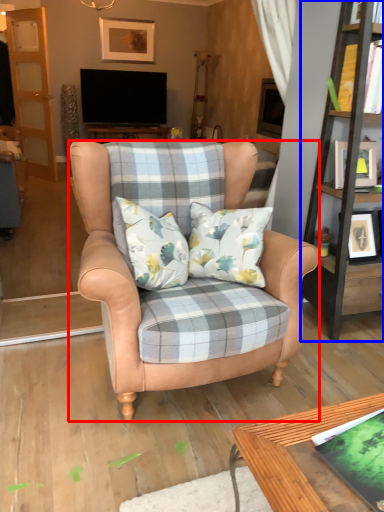
Question: Which object is closer to the camera taking this photo, chair (highlighted by a red box) or bookshelf (highlighted by a blue box)?

Choices:
 (A) chair
 (B) bookshelf

Answer: (A)